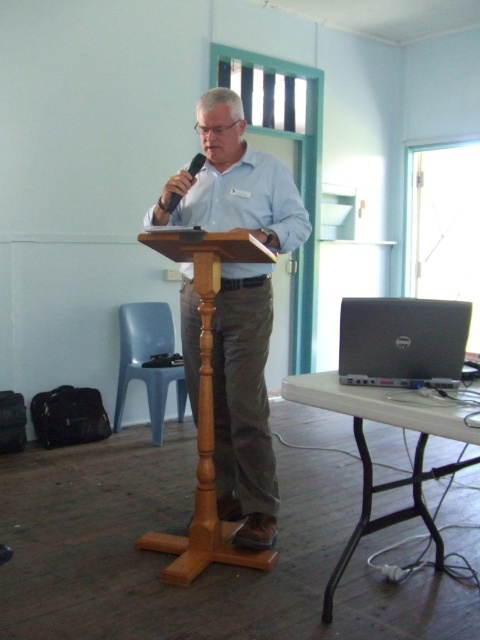
Between dell laptop at right and light blue cotton shirt at center, which one has less height?

dell laptop at right is shorter.

Can you confirm if dell laptop at right is positioned to the left of light blue cotton shirt at center?

Incorrect, dell laptop at right is not on the left side of light blue cotton shirt at center.

Find the location of a particular element. This screenshot has height=640, width=480. dell laptop at right is located at coordinates (403, 340).

Locate an element on the screen. dell laptop at right is located at coordinates (403, 340).

Is light blue shirt at center smaller than dell laptop at right?

No, light blue shirt at center is not smaller than dell laptop at right.

Which is behind, point (160, 205) or point (411, 324)?

Point (160, 205)

The image size is (480, 640). In order to click on light blue shirt at center in this screenshot , I will do `click(243, 404)`.

Can you confirm if light blue cotton shirt at center is positioned to the right of black matte microphone at center?

Yes, light blue cotton shirt at center is to the right of black matte microphone at center.

The width and height of the screenshot is (480, 640). I want to click on light blue cotton shirt at center, so click(247, 198).